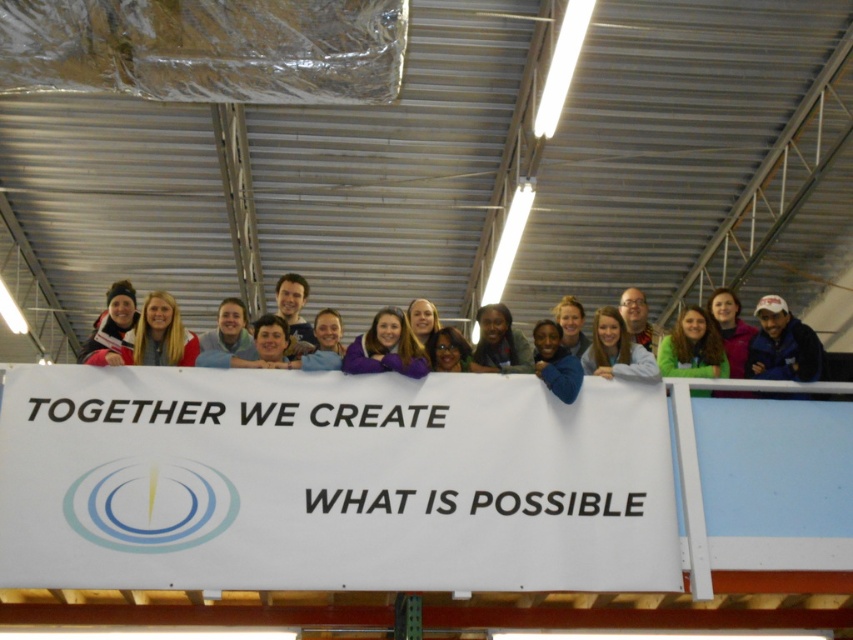
Is the position of white paper banner at center less distant than that of matte black jacket at center?

Yes, it is.

Is white paper banner at center thinner than matte black jacket at center?

No.

Measure the distance between white paper banner at center and camera.

white paper banner at center and camera are 42.79 feet apart from each other.

Locate an element on the screen. white paper banner at center is located at coordinates (331, 481).

Between blue fabric cap at right and light brown hair at center, which one appears on the right side from the viewer's perspective?

From the viewer's perspective, blue fabric cap at right appears more on the right side.

Between point (791, 320) and point (630, 369), which one is positioned behind?

Point (791, 320)

Identify the location of blue fabric cap at right. (782, 344).

Does matte purple sweater at center appear under matte black jacket at center?

Yes.

Between matte purple sweater at center and matte black jacket at center, which one appears on the left side from the viewer's perspective?

Positioned to the left is matte purple sweater at center.

I want to click on matte purple sweater at center, so click(x=386, y=348).